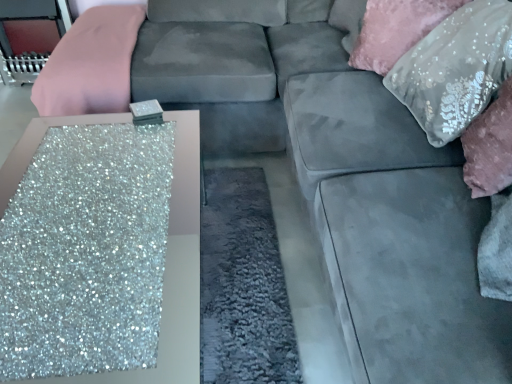
Question: Is point (188, 350) positioned closer to the camera than point (413, 87)?

Choices:
 (A) farther
 (B) closer

Answer: (A)

Question: Considering their positions, is glittery silver table at lower left located in front of or behind satin silver pillow at upper right, positioned as the 1th pillow in front-to-back order?

Choices:
 (A) behind
 (B) front

Answer: (B)

Question: Based on their relative distances, which object is nearer to the satin silver pillow at upper right, the 2th pillow when ordered from back to front?

Choices:
 (A) sequined fabric pillow at upper right, arranged as the 1th pillow when viewed from the back
 (B) glittery silver table at lower left

Answer: (A)

Question: Which is nearer to the sequined fabric pillow at upper right, arranged as the 1th pillow when viewed from the back?

Choices:
 (A) satin silver pillow at upper right, positioned as the 1th pillow in front-to-back order
 (B) glittery silver table at lower left

Answer: (A)